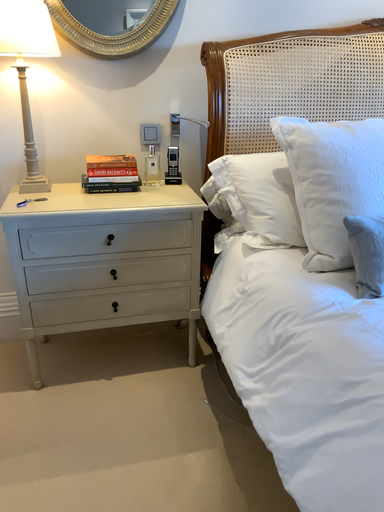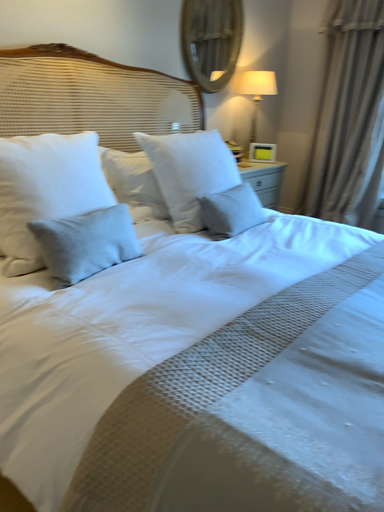
Question: How did the camera likely rotate when shooting the video?

Choices:
 (A) rotated right
 (B) rotated left

Answer: (A)